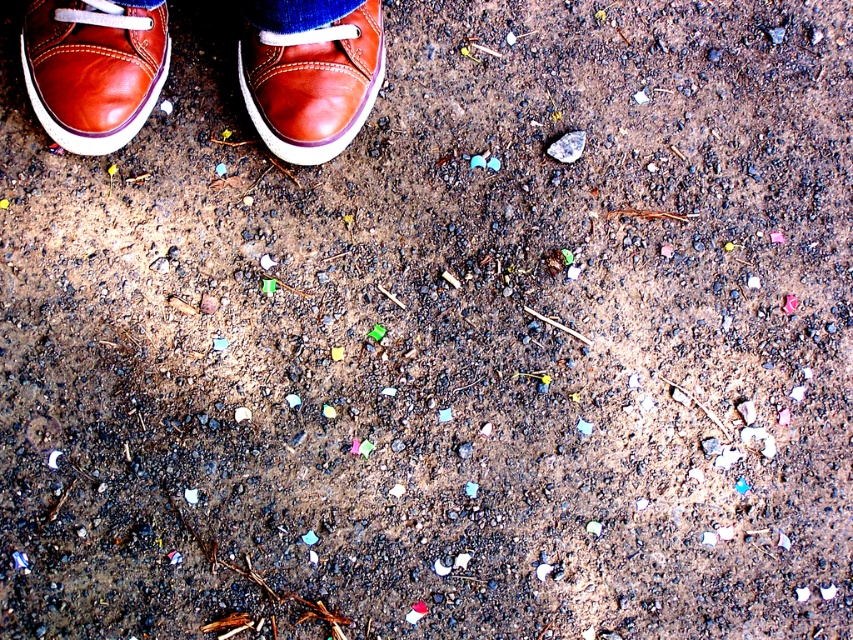
Question: Is brown leather shoes at upper left above blue denim jeans at upper center?

Choices:
 (A) yes
 (B) no

Answer: (B)

Question: Which of the following is the closest to the observer?

Choices:
 (A) (71, 76)
 (B) (328, 4)

Answer: (A)

Question: Which object is the farthest from the brown leather shoes at upper left?

Choices:
 (A) matte brown shoe at center
 (B) blue denim jeans at upper center

Answer: (B)

Question: Does matte brown shoe at center appear on the right side of brown leather shoe at upper center?

Choices:
 (A) no
 (B) yes

Answer: (A)

Question: Does matte brown shoe at center appear on the right side of blue denim jeans at upper center?

Choices:
 (A) yes
 (B) no

Answer: (B)

Question: Which object appears closest to the camera in this image?

Choices:
 (A) matte brown shoe at center
 (B) brown leather shoes at upper left
 (C) brown leather shoe at upper center
 (D) blue denim jeans at upper center

Answer: (A)